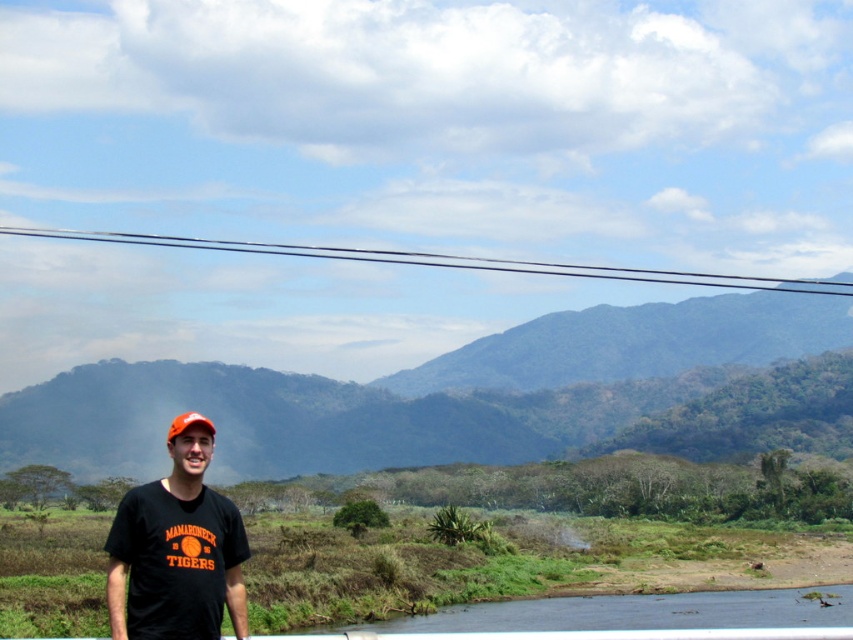
You are a photographer trying to capture the perfect shot of the person in the MAMARONECK TIGERS shirt. You notice two points in the image at coordinates point (181, 486) and point (659, 278). Which point should you position your camera closer to in order to focus on the person without the other point blocking the view?

You should position your camera closer to point (181, 486) because it is in front of point (659, 278), so focusing on the front point will ensure the person is visible without obstruction.